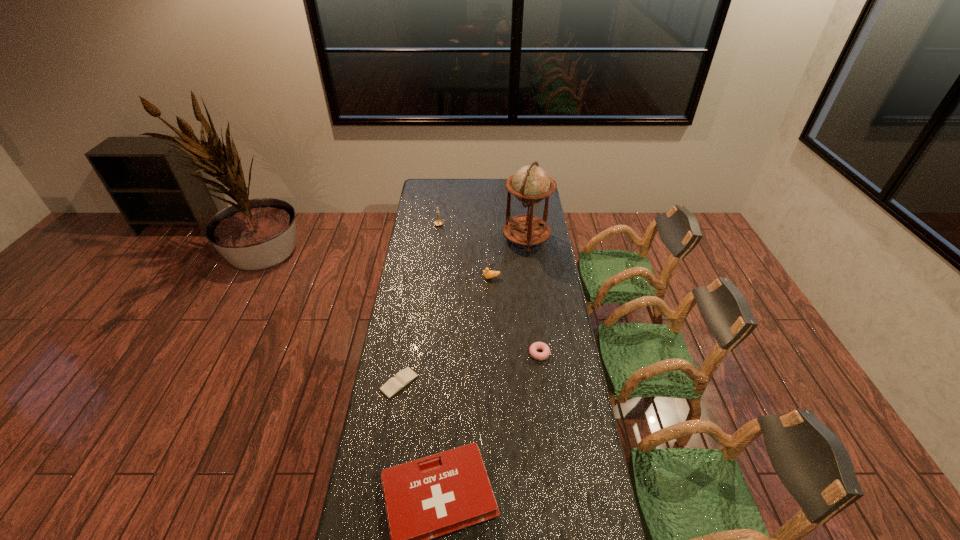
Where is `the tallest object`? the tallest object is located at coordinates 530,184.

I want to click on candle holder, so click(438, 222).

The width and height of the screenshot is (960, 540). I want to click on the fourth nearest object, so click(487, 274).

Find the location of a particular element. This screenshot has height=540, width=960. the second shortest object is located at coordinates (544, 347).

Where is `the third nearest object`? the third nearest object is located at coordinates (544, 347).

This screenshot has width=960, height=540. In order to click on the second nearest object in this screenshot , I will do `click(395, 384)`.

I want to click on the shortest object, so click(x=395, y=384).

Locate an element on the screen. The width and height of the screenshot is (960, 540). vacant region located 0.240m on the surface of the tallest object is located at coordinates (458, 239).

Locate an element on the screen. free point located 0.100m on the surface of the tallest object is located at coordinates (484, 239).

You are a GUI agent. You are given a task and a screenshot of the screen. Output one action in this format:
    pyautogui.click(x=<x>, y=<y>)
    Task: Click on the vacant space located 0.360m on the surface of the tallest object
    
    Given the screenshot: What is the action you would take?
    pyautogui.click(x=436, y=239)